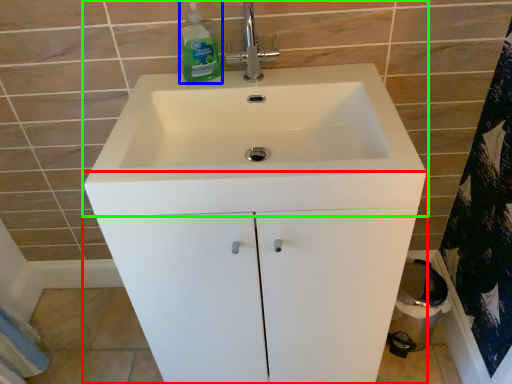
Question: Which object is positioned farthest from bathroom cabinet (highlighted by a red box)? Select from cleaning product (highlighted by a blue box) and sink (highlighted by a green box).

Choices:
 (A) cleaning product
 (B) sink

Answer: (A)